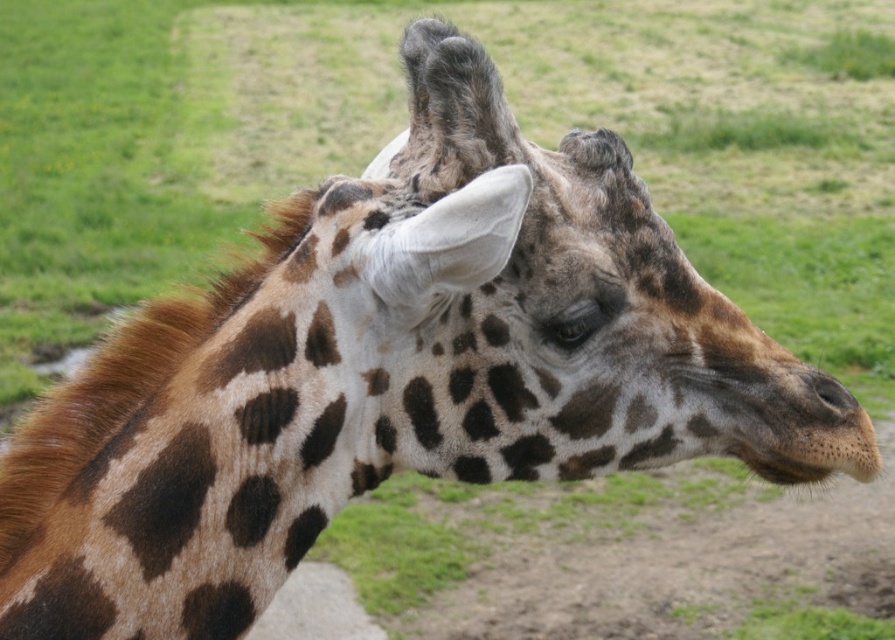
Can you confirm if brown spotted fur at center is positioned to the right of brown textured fur at center?

Indeed, brown spotted fur at center is positioned on the right side of brown textured fur at center.

Between brown spotted fur at center and brown textured fur at center, which one is positioned higher?

brown spotted fur at center is above.

This screenshot has height=640, width=895. In order to click on brown spotted fur at center in this screenshot , I will do [567, 314].

Can you confirm if brown spotted fur at center is thinner than brown textured nose at lower right?

No.

Does brown spotted fur at center appear over brown textured nose at lower right?

Correct, brown spotted fur at center is located above brown textured nose at lower right.

Measure the distance between brown spotted fur at center and camera.

brown spotted fur at center is 94.27 centimeters away from camera.

What are the coordinates of `brown spotted fur at center` in the screenshot? It's located at (567, 314).

Between brown textured fur at center and brown textured nose at lower right, which one appears on the left side from the viewer's perspective?

brown textured fur at center is more to the left.

Is brown textured fur at center to the left of brown textured nose at lower right from the viewer's perspective?

Correct, you'll find brown textured fur at center to the left of brown textured nose at lower right.

Who is more distant from viewer, (133, 368) or (837, 419)?

Positioned behind is point (837, 419).

Where is `brown textured fur at center`? brown textured fur at center is located at coordinates (194, 456).